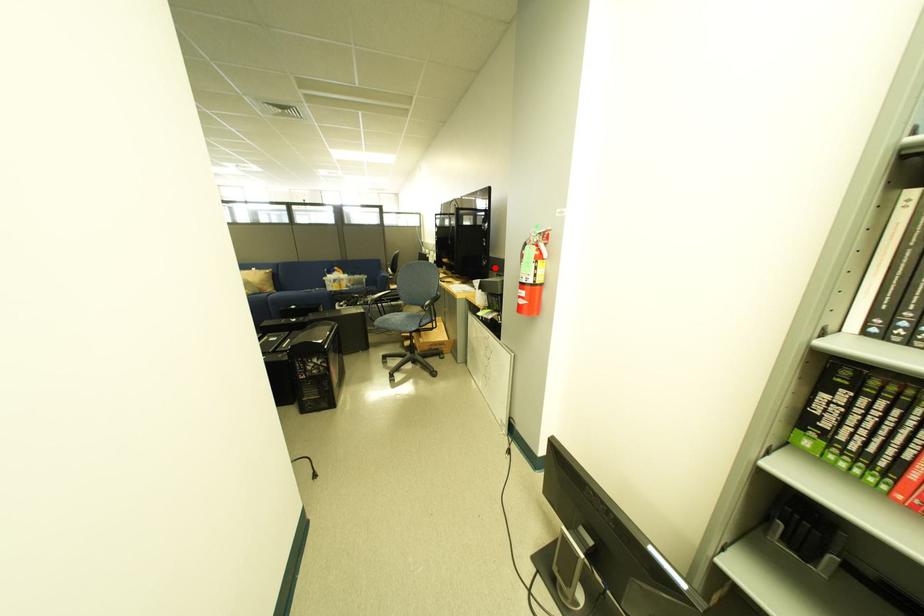
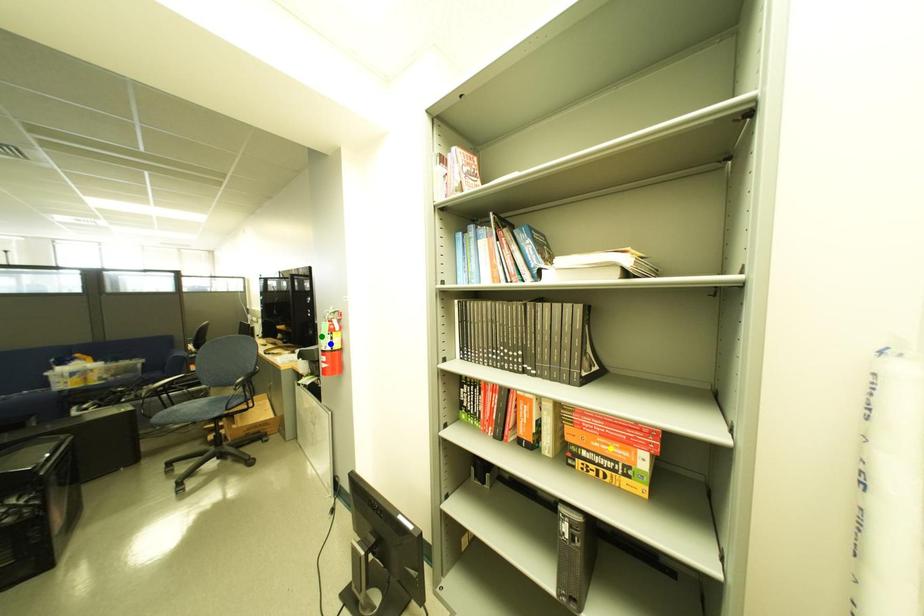
Question: I am providing you with two images of the same scene from different viewpoints. A red point is marked on the first image. You are given multiple points on the second image. Which mark in image 2 goes with the point in image 1?

Choices:
 (A) green point
 (B) yellow point
 (C) blue point

Answer: (A)